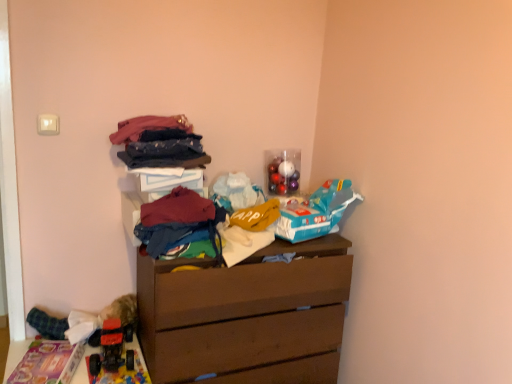
Question: Is plush fabric toy at lower left, which is the third toy in top-to-bottom order, to the left or to the right of dark blue denim jeans at center, which is the third clothing from bottom to top, in the image?

Choices:
 (A) left
 (B) right

Answer: (A)

Question: Based on their sizes in the image, would you say plush fabric toy at lower left, which ranks as the fourth toy in right-to-left order, is bigger or smaller than dark blue denim jeans at center, which is the 3th clothing from top to bottom?

Choices:
 (A) small
 (B) big

Answer: (B)

Question: Based on their relative distances, which object is nearer to the matte pink fabric at upper center, which appears as the first clothing when viewed from the top?

Choices:
 (A) maroon fabric at center, which ranks as the second clothing in bottom-to-top order
 (B) brown matte chest of drawers at center
 (C) blue matte toy airplane at upper right, the first toy viewed from the right
 (D) plush fabric toy at lower left, the 1th toy viewed from the left
 (E) dark blue denim jeans at center, which is the 3th clothing from top to bottom

Answer: (E)

Question: Estimate the real-world distances between objects in this image. Which object is closer to the dark blue denim jeans at center, which is the 3th clothing from top to bottom?

Choices:
 (A) maroon fabric at center, the fourth clothing viewed from the top
 (B) plastic toy car at lower left
 (C) brown matte chest of drawers at center
 (D) denim jeans at upper center, which is the 2th clothing from top to bottom
 (E) blue matte toy airplane at upper right, arranged as the third toy when ordered from the bottom

Answer: (D)